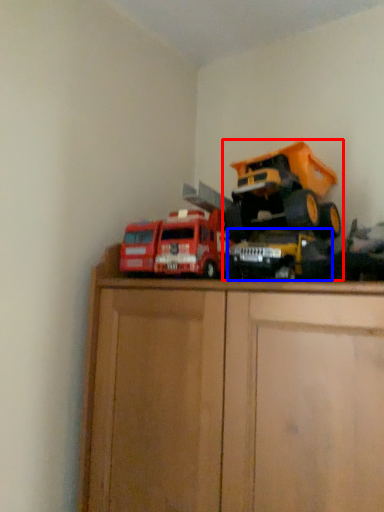
Question: Which of the following is the farthest to the observer, toy (highlighted by a red box) or toy (highlighted by a blue box)?

Choices:
 (A) toy
 (B) toy

Answer: (A)